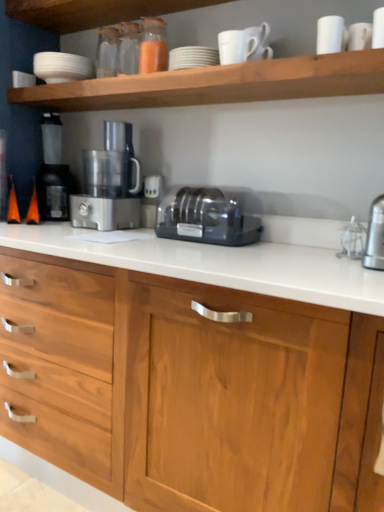
Image resolution: width=384 pixels, height=512 pixels. What are the coordinates of `white matte cup at upper right, placed as the 1th tableware when sorted from front to back` in the screenshot? It's located at (329, 34).

You are a GUI agent. You are given a task and a screenshot of the screen. Output one action in this format:
    pyautogui.click(x=<x>, y=<y>)
    Task: Click on the white matte shelf at upper center
    This screenshot has height=512, width=384.
    Given the screenshot: What is the action you would take?
    pyautogui.click(x=217, y=84)

What do you see at coordinates (153, 46) in the screenshot? I see `translucent glass spice at upper center` at bounding box center [153, 46].

Where is `white matte cup at upper right, which is the 2th tableware in left-to-right order`? white matte cup at upper right, which is the 2th tableware in left-to-right order is located at coordinates (329, 34).

How far apart are white matte bowl at upper left, acting as the first tableware starting from the back, and white matte shelf at upper center?

white matte bowl at upper left, acting as the first tableware starting from the back, is 15.66 inches from white matte shelf at upper center.

Which is closer to the camera, (x=57, y=64) or (x=280, y=75)?

The point (x=280, y=75) is closer.

Is white matte bowl at upper left, the 2th tableware from the bottom, facing away from white matte shelf at upper center?

That's not correct — white matte bowl at upper left, the 2th tableware from the bottom, is not looking away from white matte shelf at upper center.

Is there a large distance between white matte bowl at upper left, the 2th tableware from the bottom, and white matte shelf at upper center?

No.

Is black plastic coffee machine at left not inside white matte cup at upper right, the second tableware positioned from the top?

black plastic coffee machine at left is positioned outside white matte cup at upper right, the second tableware positioned from the top.

Does black plastic coffee machine at left appear on the right side of white matte cup at upper right, placed as the 1th tableware when sorted from front to back?

In fact, black plastic coffee machine at left is to the left of white matte cup at upper right, placed as the 1th tableware when sorted from front to back.

Is black plastic coffee machine at left positioned with its back to white matte cup at upper right, the 1th tableware positioned from the right?

No, black plastic coffee machine at left's orientation is not away from white matte cup at upper right, the 1th tableware positioned from the right.

From the image's perspective, is wooden cabinet at center above or below black plastic toaster at center?

Based on their image positions, wooden cabinet at center is located beneath black plastic toaster at center.

Is the surface of wooden cabinet at center in direct contact with black plastic toaster at center?

They are not placed beside each other.

Between wooden cabinet at center and black plastic toaster at center, which one appears on the right side from the viewer's perspective?

black plastic toaster at center.

Is black plastic toaster at center completely or partially inside wooden cabinet at center?

No, black plastic toaster at center is not a part of wooden cabinet at center.

Is black plastic toaster at center positioned with its back to white matte bowl at upper left, the second tableware positioned from the front?

No, black plastic toaster at center's orientation is not away from white matte bowl at upper left, the second tableware positioned from the front.

Which object is closer to the camera, black plastic toaster at center or white matte bowl at upper left, which is the first tableware in top-to-bottom order?

black plastic toaster at center is in front.

Find the location of a particular element. tableware that is the 2nd one above the black plastic toaster at center (from a real-world perspective) is located at coordinates (62, 67).

Does black plastic toaster at center have a lesser height compared to white matte bowl at upper left, which is the first tableware in top-to-bottom order?

No, black plastic toaster at center is not shorter than white matte bowl at upper left, which is the first tableware in top-to-bottom order.

Which is more to the left, black plastic coffee machine at left or wooden cabinet at center?

black plastic coffee machine at left.

What's the angular difference between black plastic coffee machine at left and wooden cabinet at center's facing directions?

The angular difference between black plastic coffee machine at left and wooden cabinet at center is 3.52 degrees.

From the image's perspective, would you say black plastic coffee machine at left is positioned over wooden cabinet at center?

Indeed, from the image's perspective, black plastic coffee machine at left is shown above wooden cabinet at center.

Is black plastic coffee machine at left thinner than wooden cabinet at center?

Yes.

Choose the correct answer: Is satin silver food processor at center inside translucent glass spice at upper center or outside it?

satin silver food processor at center is outside translucent glass spice at upper center.

From the image's perspective, which one is positioned higher, satin silver food processor at center or translucent glass spice at upper center?

translucent glass spice at upper center, from the image's perspective.

Between satin silver food processor at center and translucent glass spice at upper center, which one has less height?

translucent glass spice at upper center is shorter.

How many degrees apart are the facing directions of satin silver food processor at center and translucent glass spice at upper center?

2.44 degrees separate the facing orientations of satin silver food processor at center and translucent glass spice at upper center.

Is white matte bowl at upper left, which is counted as the 2th tableware, starting from the right, outside of black plastic toaster at center?

Yes, white matte bowl at upper left, which is counted as the 2th tableware, starting from the right, is located beyond the bounds of black plastic toaster at center.

Which of these two, white matte bowl at upper left, the 2th tableware from the bottom, or black plastic toaster at center, is thinner?

With smaller width is black plastic toaster at center.

Considering the points (49, 61) and (188, 220), which point is behind, point (49, 61) or point (188, 220)?

The point (49, 61) is farther from the camera.

Which object is closer to the camera taking this photo, white matte bowl at upper left, acting as the first tableware starting from the back, or black plastic toaster at center?

black plastic toaster at center is in front.

Image resolution: width=384 pixels, height=512 pixels. In order to click on shelf on the right of white matte bowl at upper left, acting as the first tableware starting from the back in this screenshot , I will do `click(217, 84)`.

From the image's perspective, which tableware is the 1st one above the black plastic coffee machine at left? Please provide its 2D coordinates.

[(329, 34)]

Based on their spatial positions, is black plastic coffee machine at left or translucent glass spice at upper center closer to white matte bowl at upper left, which is the first tableware in top-to-bottom order?

translucent glass spice at upper center is closer to white matte bowl at upper left, which is the first tableware in top-to-bottom order.

Which object lies further to the anchor point white matte shelf at upper center, satin silver food processor at center or wooden cabinet at center?

wooden cabinet at center lies further to white matte shelf at upper center than the other object.

From the image, which object appears to be nearer to translucent glass spice at upper center, white matte cup at upper right, placed as the 1th tableware when sorted from front to back, or black plastic toaster at center?

black plastic toaster at center lies closer to translucent glass spice at upper center than the other object.

Considering their positions, is wooden cabinet at center positioned closer to white matte shelf at upper center than black plastic coffee machine at left?

black plastic coffee machine at left is closer to white matte shelf at upper center.

From the image, which object appears to be farther from satin silver food processor at center, white matte bowl at upper left, the second tableware positioned from the front, or black plastic coffee machine at left?

white matte bowl at upper left, the second tableware positioned from the front, is further to satin silver food processor at center.

Which object lies nearer to the anchor point satin silver food processor at center, black plastic toaster at center or white matte bowl at upper left, acting as the first tableware starting from the back?

Based on the image, black plastic toaster at center appears to be nearer to satin silver food processor at center.

Considering their positions, is translucent glass spice at upper center positioned closer to satin silver food processor at center than black plastic toaster at center?

Based on the image, black plastic toaster at center appears to be nearer to satin silver food processor at center.

From the image, which object appears to be nearer to black plastic toaster at center, wooden cabinet at center or black plastic coffee machine at left?

Based on the image, wooden cabinet at center appears to be nearer to black plastic toaster at center.

Where is `shelf between white matte bowl at upper left, the 2th tableware from the bottom, and black plastic toaster at center in the up-down direction`? shelf between white matte bowl at upper left, the 2th tableware from the bottom, and black plastic toaster at center in the up-down direction is located at coordinates (217, 84).

The height and width of the screenshot is (512, 384). What are the coordinates of `shelf between white matte bowl at upper left, the second tableware positioned from the front, and white matte cup at upper right, the 1th tableware positioned from the right` in the screenshot? It's located at (217, 84).

Locate an element on the screen. tableware that lies between translucent glass spice at upper center and wooden cabinet at center from top to bottom is located at coordinates (329, 34).

Where is `home appliance between white matte bowl at upper left, acting as the first tableware starting from the back, and black plastic toaster at center in the up-down direction`? This screenshot has height=512, width=384. home appliance between white matte bowl at upper left, acting as the first tableware starting from the back, and black plastic toaster at center in the up-down direction is located at coordinates (109, 183).